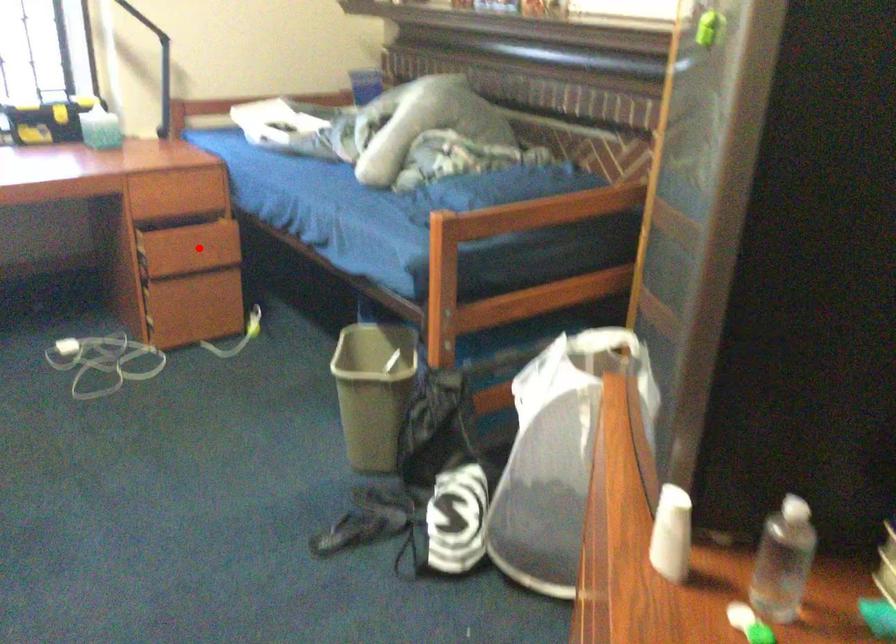
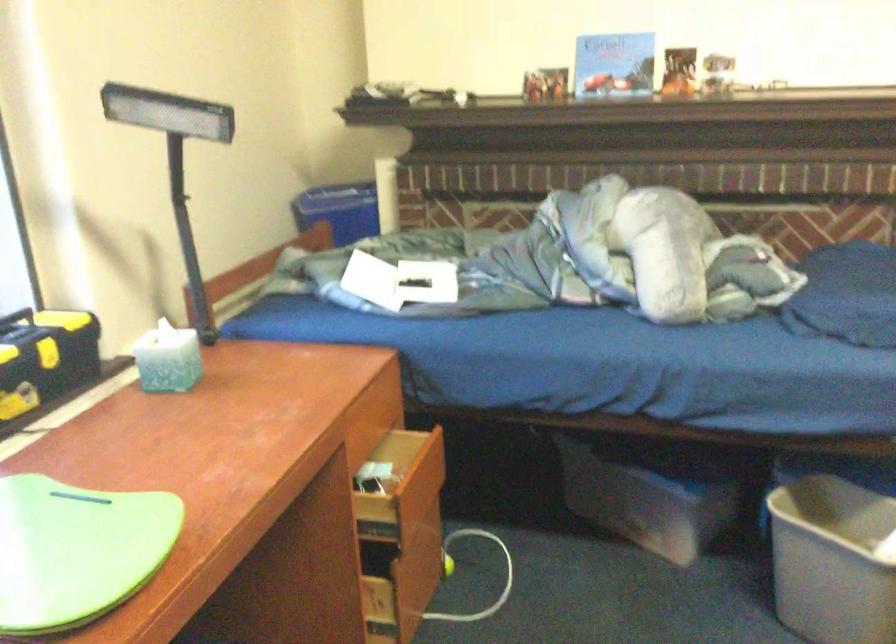
Locate, in the second image, the point that corresponds to the highlighted location in the first image.

(419, 489)